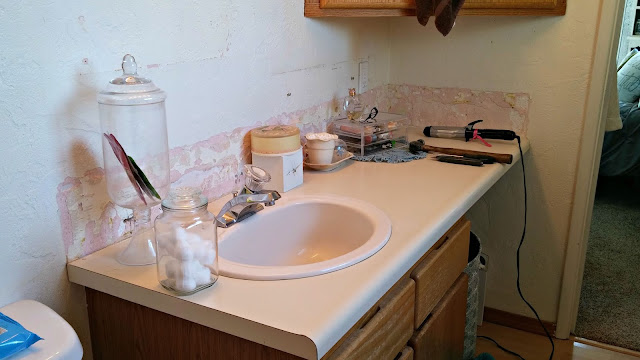
Image resolution: width=640 pixels, height=360 pixels. Identify the location of jar. (146, 124).